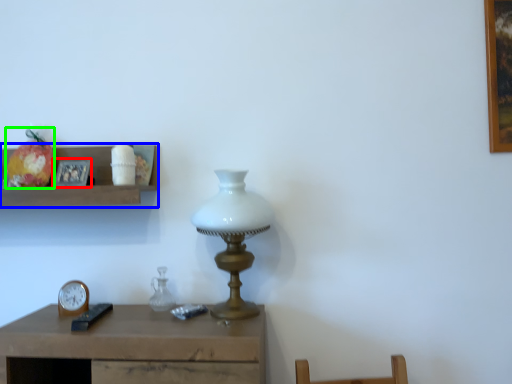
Question: Which object is the farthest from picture frame (highlighted by a red box)? Choose among these: shelf (highlighted by a blue box) or fruit (highlighted by a green box).

Choices:
 (A) shelf
 (B) fruit

Answer: (B)